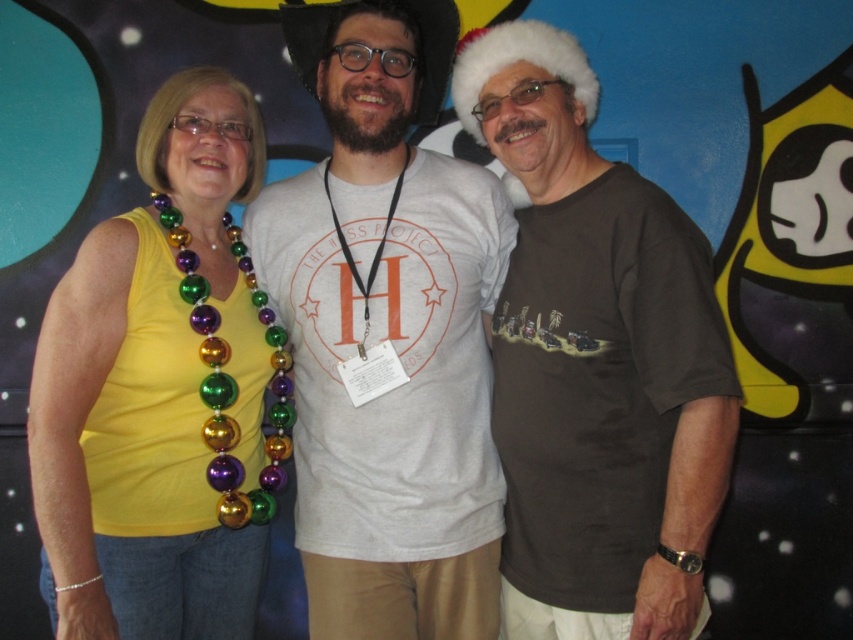
Question: Can you confirm if white cotton t-shirt at center is wider than brown matte shirt at right?

Choices:
 (A) no
 (B) yes

Answer: (B)

Question: Which point is closer to the camera taking this photo?

Choices:
 (A) (122, 492)
 (B) (573, 129)

Answer: (A)

Question: Which object appears closest to the camera in this image?

Choices:
 (A) yellow fabric tank top at left
 (B) white cotton t-shirt at center

Answer: (A)

Question: Can you confirm if white cotton t-shirt at center is bigger than brown matte shirt at right?

Choices:
 (A) no
 (B) yes

Answer: (B)

Question: Which of these objects is positioned closest to the yellow fabric tank top at left?

Choices:
 (A) white cotton t-shirt at center
 (B) brown matte shirt at right

Answer: (A)

Question: Is brown matte shirt at right closer to the viewer compared to yellow fabric tank top at left?

Choices:
 (A) no
 (B) yes

Answer: (B)